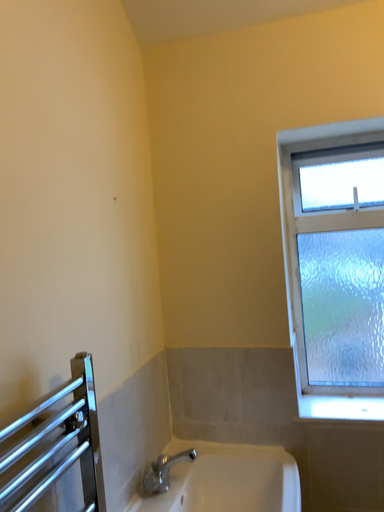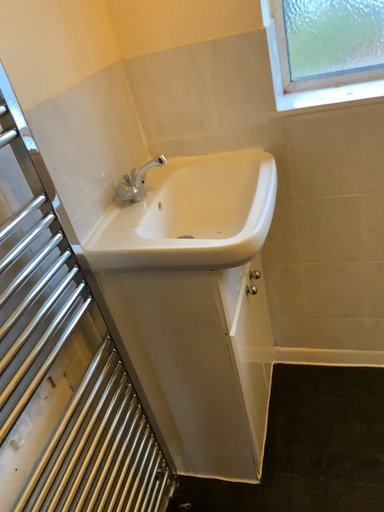
Question: Which way did the camera rotate in the video?

Choices:
 (A) rotated downward
 (B) rotated upward

Answer: (A)